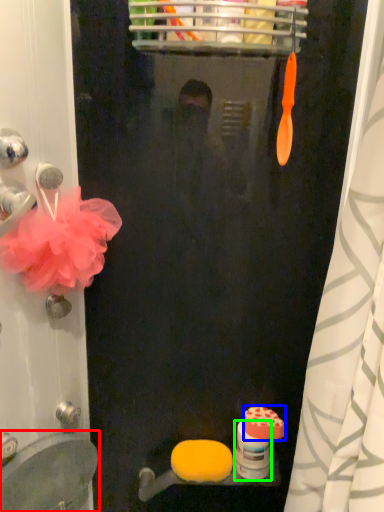
Question: Considering the real-world distances, which object is farthest from sink (highlighted by a red box)? soap (highlighted by a blue box) or toilet paper (highlighted by a green box)?

Choices:
 (A) soap
 (B) toilet paper

Answer: (A)